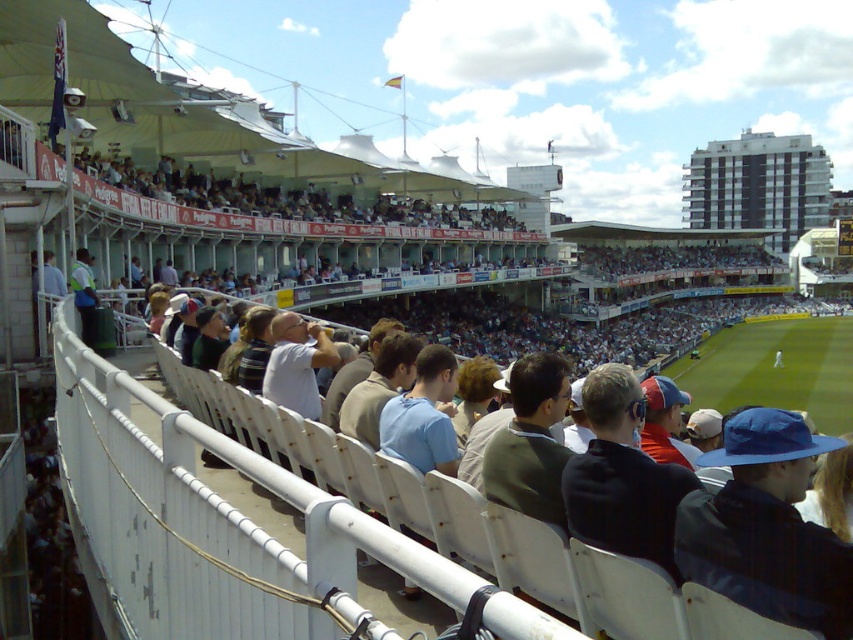
Can you confirm if green grass at center is bigger than light brown wooden bench at upper center?

Yes, green grass at center is bigger than light brown wooden bench at upper center.

From the picture: Does green grass at center appear on the left side of light brown wooden bench at upper center?

In fact, green grass at center is to the right of light brown wooden bench at upper center.

Find the location of a particular element. green grass at center is located at coordinates [x=775, y=369].

At what (x,y) coordinates should I click in order to perform the action: click on green grass at center. Please return your answer as a coordinate pair (x, y). The image size is (853, 640). Looking at the image, I should click on (775, 369).

Locate an element on the screen. dark blue cap at center is located at coordinates click(x=622, y=476).

Who is higher up, dark blue cap at center or light brown wooden bench at upper center?

light brown wooden bench at upper center

Who is more distant from viewer, [656,472] or [167,196]?

Point [167,196]

Identify the location of dark blue cap at center. The height and width of the screenshot is (640, 853). (622, 476).

Is point (619, 417) less distant than point (672, 380)?

Yes, point (619, 417) is closer to viewer.

Does dark blue cap at center have a smaller size compared to green grass at center?

Yes, dark blue cap at center is smaller than green grass at center.

Is point (628, 484) positioned in front of point (769, 337)?

Yes, point (628, 484) is closer to viewer.

Image resolution: width=853 pixels, height=640 pixels. In order to click on dark blue cap at center in this screenshot , I will do `click(622, 476)`.